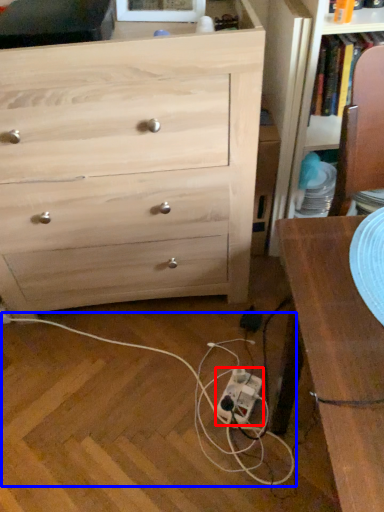
Question: Which of the following is the closest to the observer, extension cord (highlighted by a red box) or string (highlighted by a blue box)?

Choices:
 (A) extension cord
 (B) string

Answer: (B)